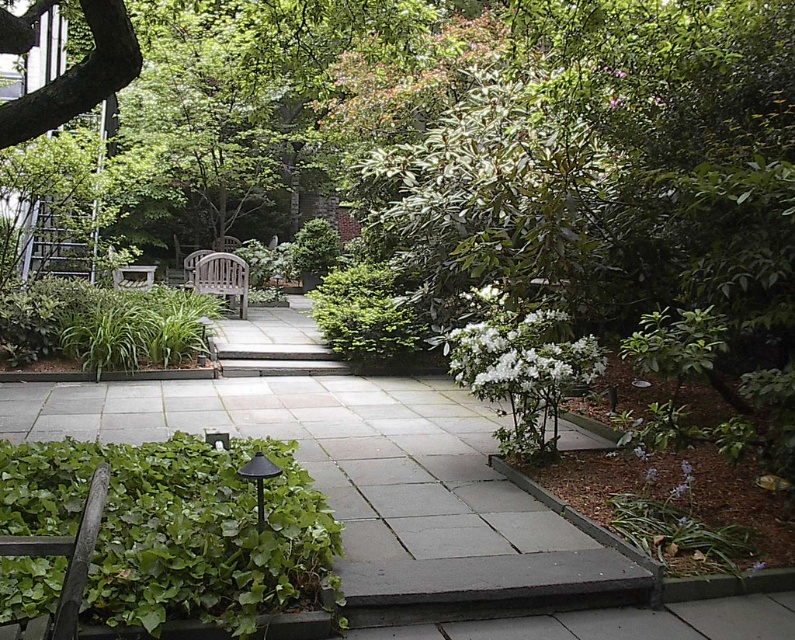
Question: Estimate the real-world distances between objects in this image. Which object is closer to the gray stone path at center?

Choices:
 (A) teak wood bench at center
 (B) white matte flower at upper center
 (C) white matte flower at center-right
 (D) green leafy bush at center

Answer: (C)

Question: Is green leafy bush at lower left to the right of white matte flower at center-right from the viewer's perspective?

Choices:
 (A) yes
 (B) no

Answer: (B)

Question: Is gray stone path at center smaller than green leafy bush at lower left?

Choices:
 (A) yes
 (B) no

Answer: (A)

Question: Estimate the real-world distances between objects in this image. Which object is farther from the green leafy bush at lower left?

Choices:
 (A) smooth brown bark at upper left
 (B) white matte flower at upper center

Answer: (B)

Question: Can you confirm if gray stone path at center is positioned below teak wood bench at center?

Choices:
 (A) yes
 (B) no

Answer: (A)

Question: Which point is farther from the camera taking this photo?

Choices:
 (A) (231, 260)
 (B) (580, 372)
 (C) (621, 100)

Answer: (A)